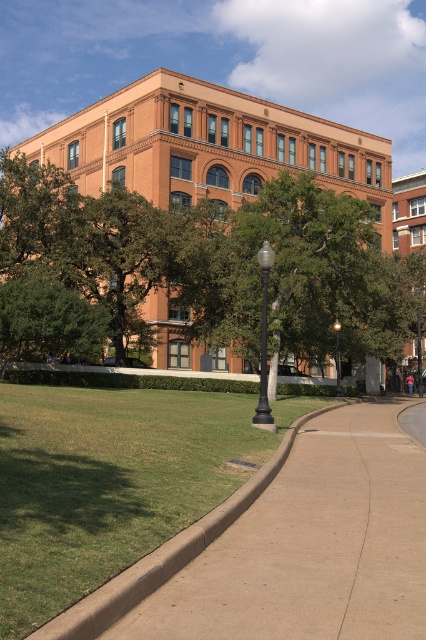
Consider the image. You are a gardener planning to plant a new shrub between the brown concrete curb at lower left and the green leafy tree at lower left. Based on their widths, which one should you place the shrub closer to?

The brown concrete curb at lower left might be wider than green leafy tree at lower left, so you should place the shrub closer to the green leafy tree at lower left to ensure there is enough space.

You are a delivery person trying to park a van that requires a minimum of 2 meters of space. You see the brown concrete curb at lower left and the black glass lamp post at center. Which object can you use to determine if there is enough space to park?

The brown concrete curb at lower left might be wider than black glass lamp post at center, so you should measure the space between the brown concrete curb at lower left and the black glass lamp post at center to determine if it meets the required 2 meters for parking the van.